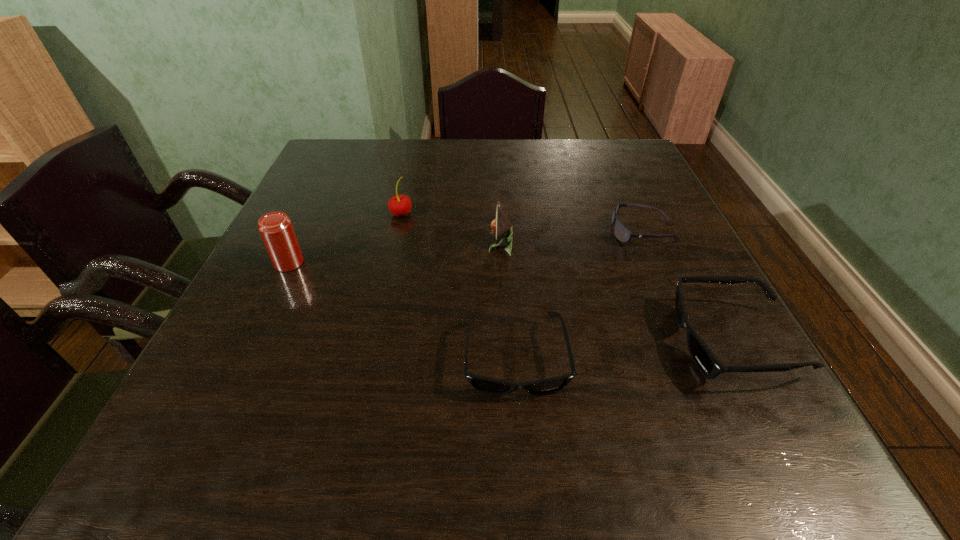
Choose which sunglasses is the second nearest neighbor to the second object from left to right. Please provide its 2D coordinates. Your answer should be formatted as a tuple, i.e. [(x, y)], where the tuple contains the x and y coordinates of a point satisfying the conditions above.

[(623, 234)]

Image resolution: width=960 pixels, height=540 pixels. What are the coordinates of `free space that satisfies the following two spatial constraints: 1. on the lenses of the shortest sunglasses; 2. on the front-facing side of the second shortest object` in the screenshot? It's located at (699, 359).

You are a GUI agent. You are given a task and a screenshot of the screen. Output one action in this format:
    pyautogui.click(x=<x>, y=<y>)
    Task: Click on the blank space that satisfies the following two spatial constraints: 1. on the lenses of the farthest sunglasses; 2. on the front-facing side of the fifth tallest object
    This screenshot has width=960, height=540.
    Given the screenshot: What is the action you would take?
    pyautogui.click(x=699, y=359)

Locate an element on the screen. The width and height of the screenshot is (960, 540). vacant space that satisfies the following two spatial constraints: 1. on the lenses of the farthest sunglasses; 2. on the front-facing side of the second shortest sunglasses is located at coordinates (699, 359).